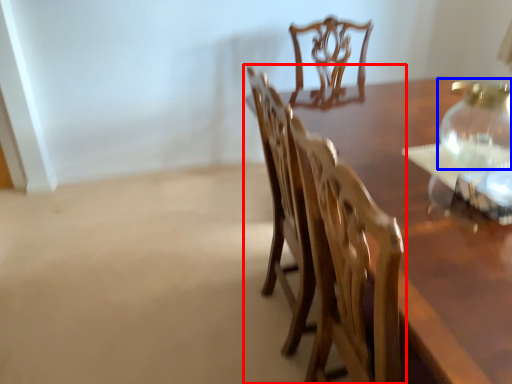
Question: Which object is further to the camera taking this photo, chair (highlighted by a red box) or glass vase (highlighted by a blue box)?

Choices:
 (A) chair
 (B) glass vase

Answer: (B)